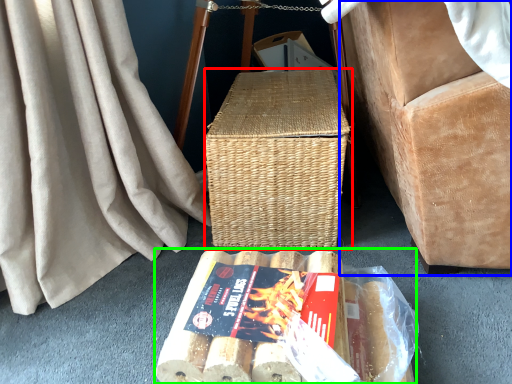
Question: Which object is positioned closest to picnic basket (highlighted by a red box)? Select from furniture (highlighted by a blue box) and food (highlighted by a green box).

Choices:
 (A) furniture
 (B) food

Answer: (A)